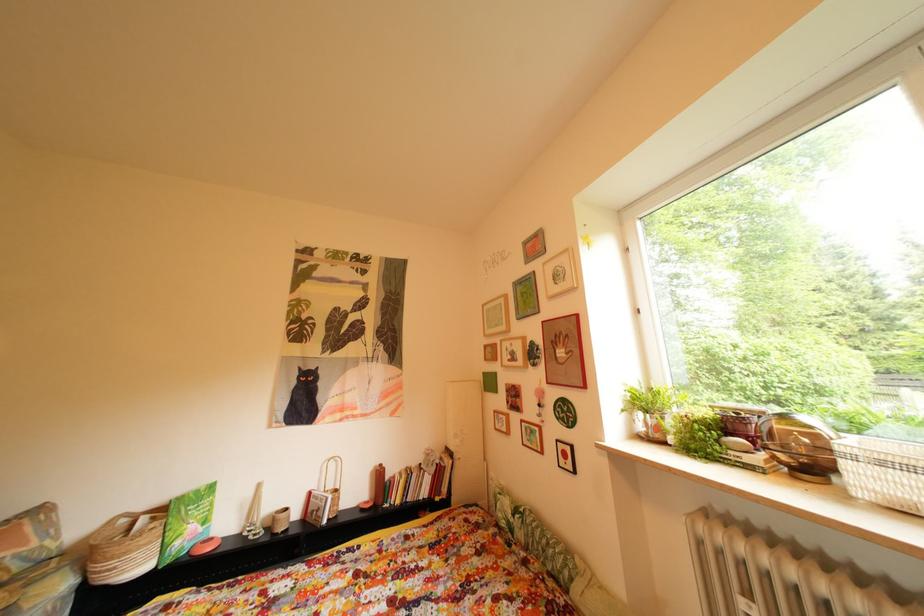
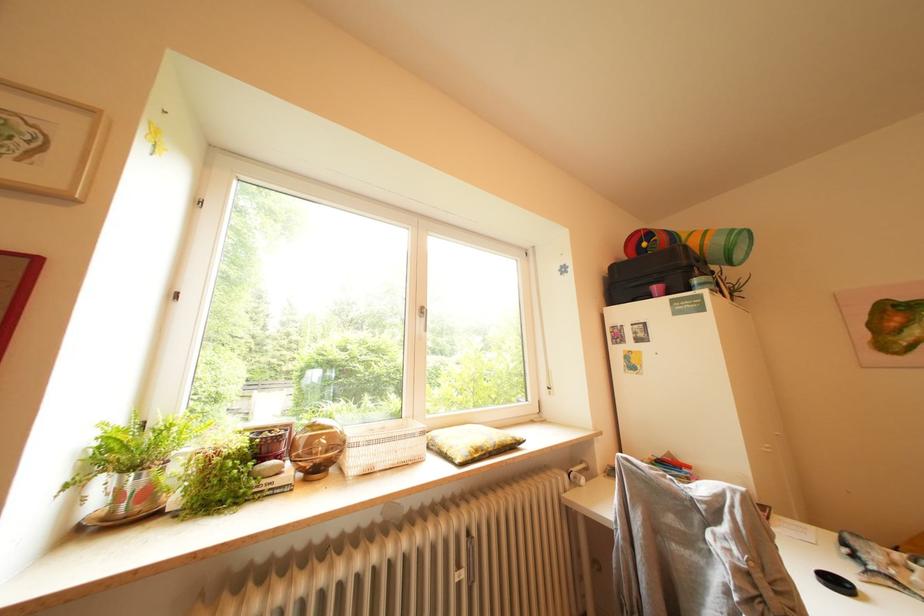
The first image is from the beginning of the video and the second image is from the end. How did the camera likely rotate when shooting the video?

The rotation direction of the camera is right-up.